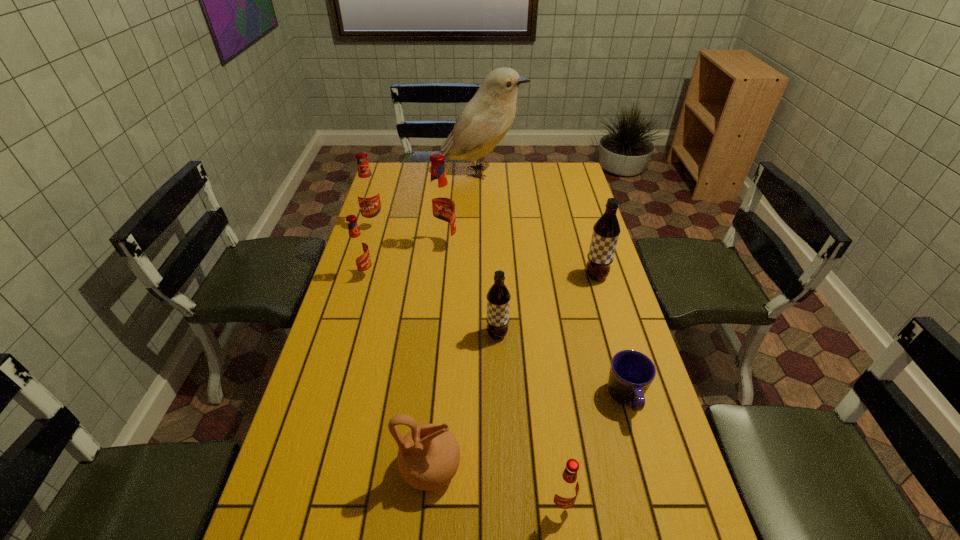
Locate an element on the screen. The image size is (960, 540). vacant area at the right edge of the desktop is located at coordinates (602, 428).

At what (x,y) coordinates should I click in order to perform the action: click on blank space at the far left corner of the desktop. Please return your answer as a coordinate pair (x, y). The image size is (960, 540). Looking at the image, I should click on (409, 183).

Find the location of a particular element. The height and width of the screenshot is (540, 960). empty location between the second smallest red root beer and the rightmost red root beer is located at coordinates (463, 390).

Locate an element on the screen. free space that is in between the second tallest object and the second biggest red root beer is located at coordinates (409, 235).

Where is `vacant point located between the pottery and the second biggest red root beer`? The height and width of the screenshot is (540, 960). vacant point located between the pottery and the second biggest red root beer is located at coordinates (402, 347).

Where is `free space that is in between the tallest root beer and the rightmost red root beer`? This screenshot has height=540, width=960. free space that is in between the tallest root beer and the rightmost red root beer is located at coordinates coord(502,375).

At what (x,y) coordinates should I click in order to perform the action: click on vacant space that is in between the second nearest red root beer and the eighth nearest object. Please return your answer as a coordinate pair (x, y). The height and width of the screenshot is (540, 960). Looking at the image, I should click on (370, 250).

Where is `vacant region between the fifth nearest root beer and the second root beer from right to left`? This screenshot has width=960, height=540. vacant region between the fifth nearest root beer and the second root beer from right to left is located at coordinates (502, 375).

I want to click on vacant area that lies between the pottery and the second smallest red root beer, so [x=397, y=372].

This screenshot has height=540, width=960. Find the location of `vacant area between the second smallest red root beer and the bigger brown root beer`. vacant area between the second smallest red root beer and the bigger brown root beer is located at coordinates (480, 276).